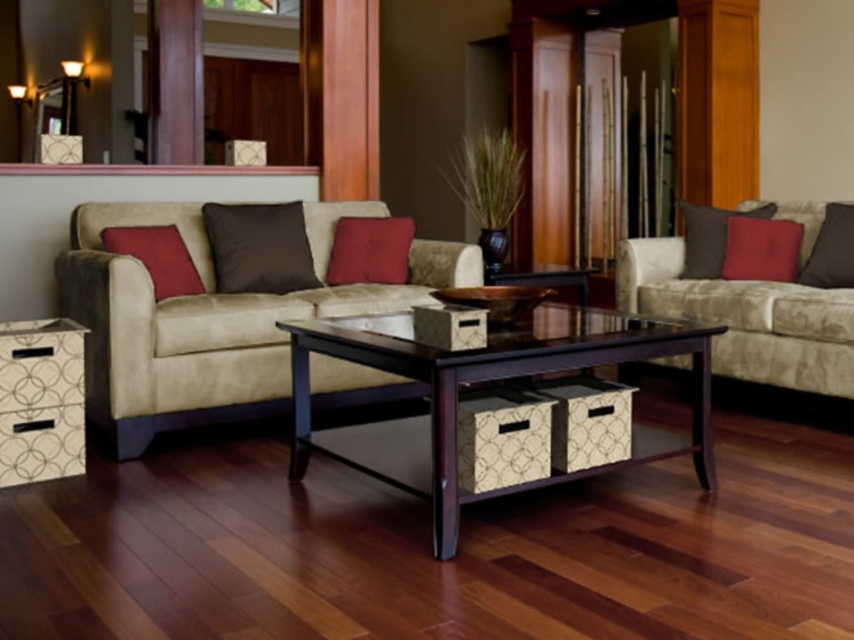
You are arranging flowers in the living room and need to place a vase between the white textured side table at lower left and the satin brown pillow at center. Based on their positions, which object should the vase be closer to?

The white textured side table at lower left is positioned on the left side of the satin brown pillow at center, so the vase should be placed closer to the white textured side table at lower left to maintain symmetry.

You are arranging a cozy reading corner in the living room and have both the satin brown pillow at center and the matte red pillow at right. Which pillow should you choose if you want a larger one for better back support?

The satin brown pillow at center is larger in size than the matte red pillow at right, so you should choose the satin brown pillow at center for better back support.